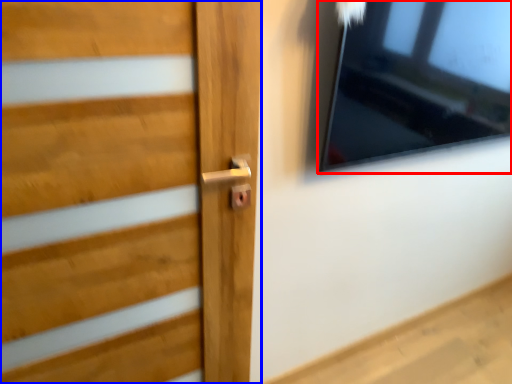
Question: Which object is closer to the camera taking this photo, window (highlighted by a red box) or door (highlighted by a blue box)?

Choices:
 (A) window
 (B) door

Answer: (B)